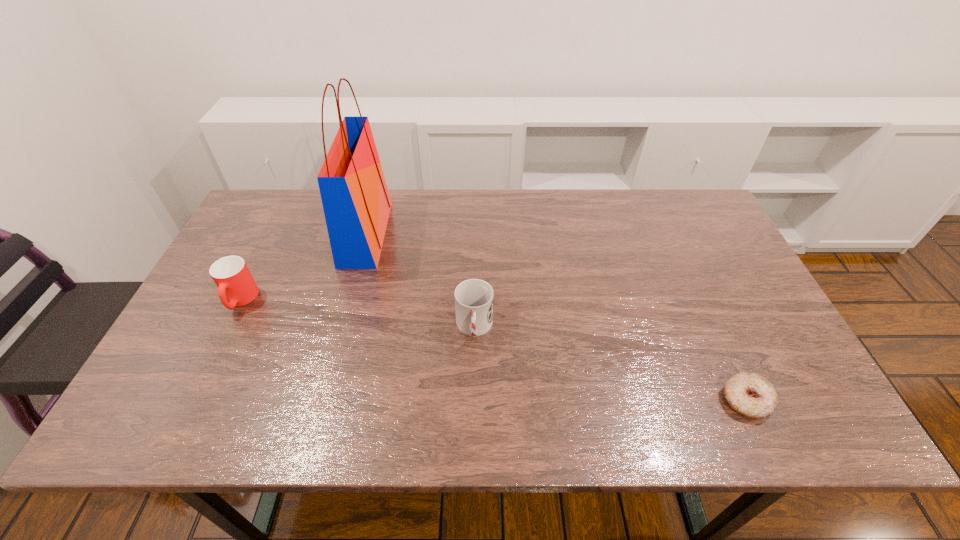
I want to click on blank space that satisfies the following two spatial constraints: 1. on the side of the left cup with the handle; 2. on the right side of the shortest object, so click(x=191, y=400).

The image size is (960, 540). I want to click on vacant space that satisfies the following two spatial constraints: 1. on the side of the leftmost object with the handle; 2. on the right side of the nearest object, so click(x=191, y=400).

What are the coordinates of `free spot that satisfies the following two spatial constraints: 1. on the handle side of the doughnut; 2. on the left side of the farthest object` in the screenshot? It's located at (321, 400).

Locate an element on the screen. Image resolution: width=960 pixels, height=540 pixels. free space that satisfies the following two spatial constraints: 1. on the side of the rightmost object with the handle; 2. on the right side of the left cup is located at coordinates (191, 400).